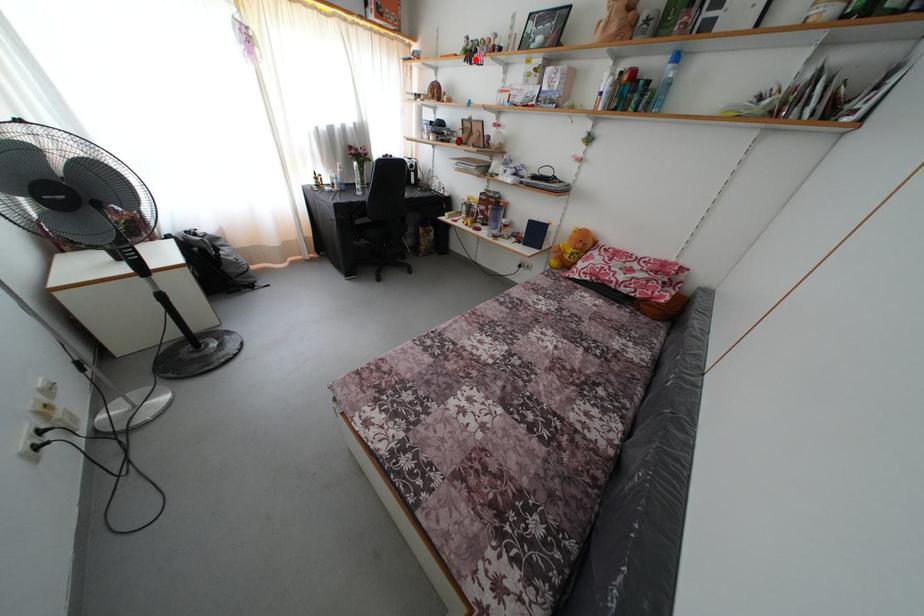
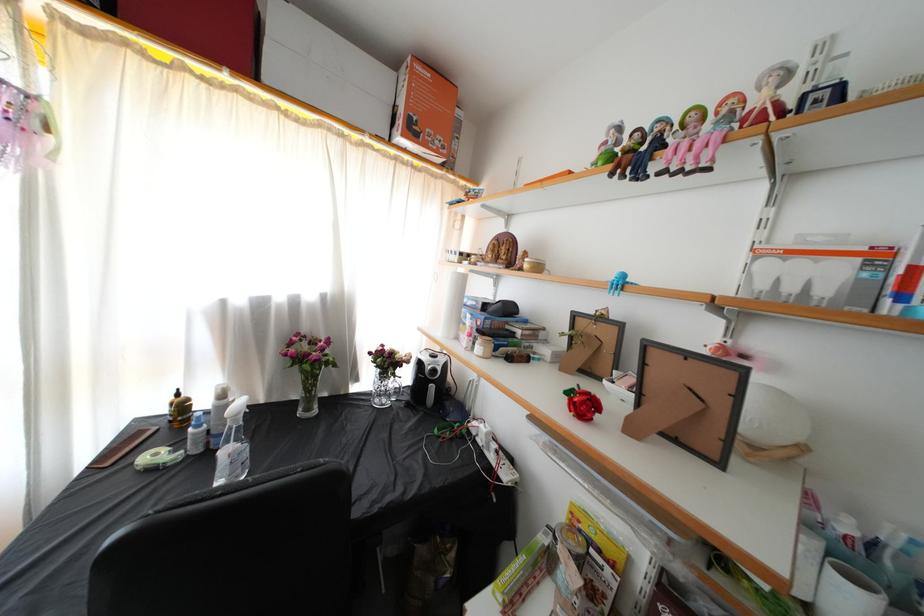
Question: I am providing you with two images of the same scene from different viewpoints. A red point is marked on the first image. At the location where the point appears in image 1, is it still visible in image 2?

Choices:
 (A) Yes
 (B) No

Answer: (A)